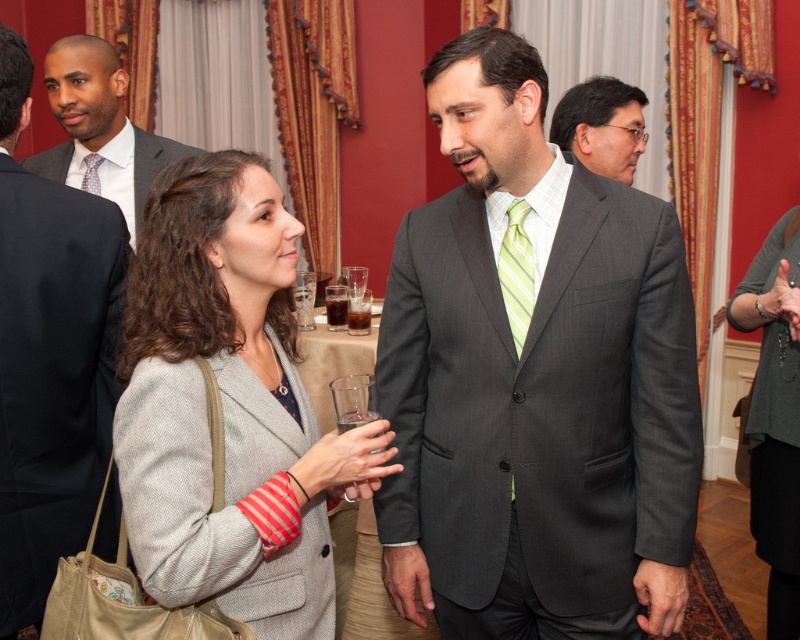
Is point (308, 310) closer to viewer compared to point (336, 317)?

No, it is not.

Is clear glass at center wider than dark brown liquid at center?

Yes, clear glass at center is wider than dark brown liquid at center.

You are a GUI agent. You are given a task and a screenshot of the screen. Output one action in this format:
    pyautogui.click(x=<x>, y=<y>)
    Task: Click on the clear glass at center
    The image size is (800, 640).
    Given the screenshot: What is the action you would take?
    pyautogui.click(x=304, y=305)

Consider the image. Who is positioned more to the left, green striped tie at center or dark brown liquid at center?

dark brown liquid at center

How distant is green striped tie at center from dark brown liquid at center?

green striped tie at center and dark brown liquid at center are 4.69 feet apart.

The width and height of the screenshot is (800, 640). In order to click on green striped tie at center in this screenshot , I will do `click(516, 273)`.

Between gray suit at center and dark brown liquid at center, which one has less height?

Standing shorter between the two is dark brown liquid at center.

Is gray suit at center wider than dark brown liquid at center?

Yes, gray suit at center is wider than dark brown liquid at center.

Who is more forward, (628, 508) or (346, 307)?

Point (628, 508)

Find the location of a particular element. gray suit at center is located at coordinates (536, 381).